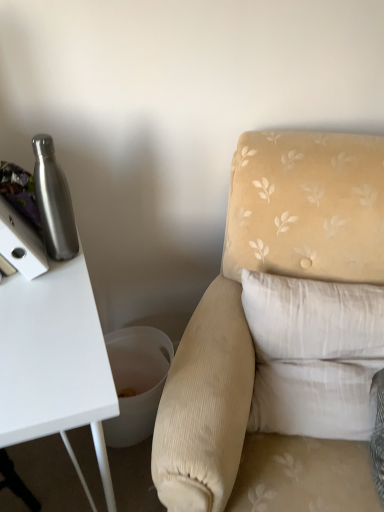
Question: Can you confirm if brushed metal water bottle at left is smaller than velvet beige armchair at center?

Choices:
 (A) no
 (B) yes

Answer: (B)

Question: Does brushed metal water bottle at left touch velvet beige armchair at center?

Choices:
 (A) yes
 (B) no

Answer: (B)

Question: Can you confirm if brushed metal water bottle at left is bigger than velvet beige armchair at center?

Choices:
 (A) yes
 (B) no

Answer: (B)

Question: Is brushed metal water bottle at left thinner than velvet beige armchair at center?

Choices:
 (A) no
 (B) yes

Answer: (B)

Question: Does brushed metal water bottle at left lie behind velvet beige armchair at center?

Choices:
 (A) no
 (B) yes

Answer: (B)

Question: In terms of width, does brushed metal water bottle at left look wider or thinner when compared to velvet beige armchair at center?

Choices:
 (A) thin
 (B) wide

Answer: (A)

Question: Considering the positions of brushed metal water bottle at left and velvet beige armchair at center in the image, is brushed metal water bottle at left taller or shorter than velvet beige armchair at center?

Choices:
 (A) tall
 (B) short

Answer: (B)

Question: From a real-world perspective, relative to velvet beige armchair at center, is brushed metal water bottle at left vertically above or below?

Choices:
 (A) above
 (B) below

Answer: (A)

Question: From the image's perspective, is brushed metal water bottle at left positioned above or below velvet beige armchair at center?

Choices:
 (A) below
 (B) above

Answer: (B)

Question: Considering the positions of white cotton pillow at right and velvet beige armchair at center in the image, is white cotton pillow at right wider or thinner than velvet beige armchair at center?

Choices:
 (A) thin
 (B) wide

Answer: (A)

Question: Choose the correct answer: Is white cotton pillow at right inside velvet beige armchair at center or outside it?

Choices:
 (A) outside
 (B) inside

Answer: (B)

Question: Is white cotton pillow at right bigger or smaller than velvet beige armchair at center?

Choices:
 (A) small
 (B) big

Answer: (A)

Question: From the image's perspective, is white cotton pillow at right positioned above or below velvet beige armchair at center?

Choices:
 (A) above
 (B) below

Answer: (A)

Question: Visually, is velvet beige armchair at center positioned to the left or to the right of brushed metal water bottle at left?

Choices:
 (A) left
 (B) right

Answer: (B)

Question: From a real-world perspective, is velvet beige armchair at center physically located above or below brushed metal water bottle at left?

Choices:
 (A) above
 (B) below

Answer: (B)